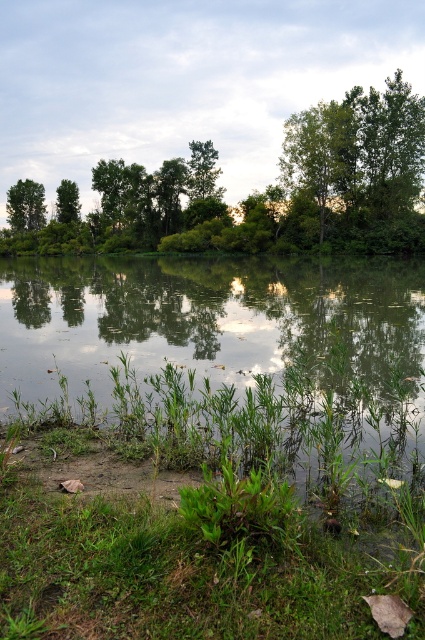
Looking at this image, you are standing in the serene natural scene and want to take a photo of both the green leafy tree at upper left and the green matte tree at upper left. Which tree should you position to the left side of your camera frame to include both in the photo?

You should position the green leafy tree at upper left to the left side of your camera frame because it is already located to the left of the green matte tree at upper left in the scene.

You are standing at a viewpoint overlooking the serene natural scene. You notice two points marked in the image. The first point is located at coordinates point (413, 161), and the second point is at point (36, 189). From your vantage point, which point appears closer to you?

Point (413, 161) is in front of point (36, 189), so it appears closer to you.

Looking at the serene natural scene, you notice the green leafy trees at upper center and the green matte tree at upper left. Which of these two trees is positioned to the right of the other?

The green leafy trees at upper center are positioned to the right of the green matte tree at upper left.